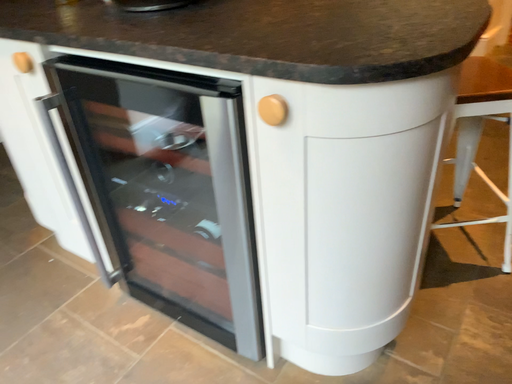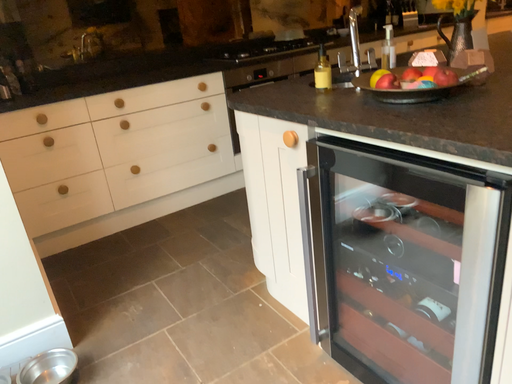
Question: How did the camera likely rotate when shooting the video?

Choices:
 (A) rotated upward
 (B) rotated downward

Answer: (A)